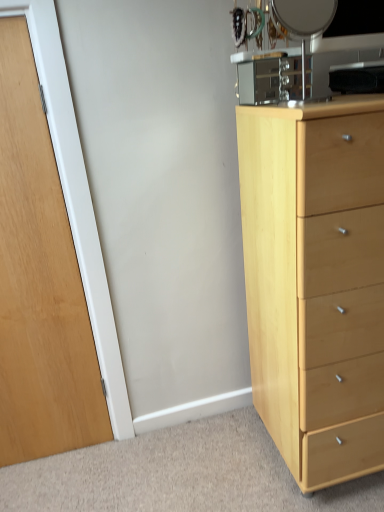
The height and width of the screenshot is (512, 384). What do you see at coordinates (39, 282) in the screenshot? I see `wooden door at left` at bounding box center [39, 282].

You are a GUI agent. You are given a task and a screenshot of the screen. Output one action in this format:
    pyautogui.click(x=<x>, y=<y>)
    Task: Click on the wooden door at left
    The width and height of the screenshot is (384, 512).
    Given the screenshot: What is the action you would take?
    pyautogui.click(x=39, y=282)

The image size is (384, 512). Find the location of `light wood chest of drawers at right`. light wood chest of drawers at right is located at coordinates (316, 280).

Where is `wooden door at left`? wooden door at left is located at coordinates (39, 282).

Considering the relative sizes of light wood chest of drawers at right and wooden door at left in the image provided, is light wood chest of drawers at right taller than wooden door at left?

Incorrect, the height of light wood chest of drawers at right is not larger of that of wooden door at left.

Which object is further away from the camera taking this photo, light wood chest of drawers at right or wooden door at left?

wooden door at left is more distant.

Does light wood chest of drawers at right have a greater width compared to wooden door at left?

Yes, light wood chest of drawers at right is wider than wooden door at left.

What's the angular difference between light wood chest of drawers at right and wooden door at left's facing directions?

There is a 0.741-degree angle between the facing directions of light wood chest of drawers at right and wooden door at left.

Locate an element on the screen. chest of drawers on the right of metallic silver mirror at upper right is located at coordinates (316, 280).

Is light wood chest of drawers at right facing away from metallic silver mirror at upper right?

No, light wood chest of drawers at right is not facing the opposite direction of metallic silver mirror at upper right.

Based on the photo, are light wood chest of drawers at right and metallic silver mirror at upper right beside each other?

No, light wood chest of drawers at right is not with metallic silver mirror at upper right.

Considering the sizes of objects light wood chest of drawers at right and metallic silver mirror at upper right in the image provided, who is thinner, light wood chest of drawers at right or metallic silver mirror at upper right?

With smaller width is metallic silver mirror at upper right.

Looking at this image, which is in front, metallic silver mirror at upper right or light wood chest of drawers at right?

light wood chest of drawers at right is closer to the camera.

Is metallic silver mirror at upper right inside the boundaries of light wood chest of drawers at right, or outside?

metallic silver mirror at upper right is outside light wood chest of drawers at right.

From a real-world perspective, who is located higher, metallic silver mirror at upper right or light wood chest of drawers at right?

metallic silver mirror at upper right is physically above.

Based on the photo, measure the distance from metallic silver mirror at upper right to light wood chest of drawers at right.

metallic silver mirror at upper right is 28.28 inches away from light wood chest of drawers at right.

Which of these two, metallic silver mirror at upper right or wooden door at left, is thinner?

wooden door at left.

From the image's perspective, is metallic silver mirror at upper right located above wooden door at left?

Yes.

Which of these two, metallic silver mirror at upper right or wooden door at left, is bigger?

wooden door at left.

How different are the orientations of wooden door at left and metallic silver mirror at upper right in degrees?

They differ by 0.741 degrees in their facing directions.

Based on the photo, between wooden door at left and metallic silver mirror at upper right, which one appears on the right side from the viewer's perspective?

Positioned to the right is metallic silver mirror at upper right.

Considering the relative sizes of wooden door at left and metallic silver mirror at upper right in the image provided, is wooden door at left wider than metallic silver mirror at upper right?

In fact, wooden door at left might be narrower than metallic silver mirror at upper right.

From the image's perspective, is wooden door at left located above or below metallic silver mirror at upper right?

wooden door at left is below metallic silver mirror at upper right.

Is point (21, 40) positioned after point (311, 334)?

Yes, it is behind point (311, 334).

Based on the photo, is wooden door at left wider or thinner than light wood chest of drawers at right?

Clearly, wooden door at left has less width compared to light wood chest of drawers at right.

Looking at this image, can you confirm if wooden door at left is bigger than light wood chest of drawers at right?

Actually, wooden door at left might be smaller than light wood chest of drawers at right.

From the image's perspective, who appears lower, wooden door at left or light wood chest of drawers at right?

light wood chest of drawers at right.

Where is `door on the left of the light wood chest of drawers at right`? This screenshot has height=512, width=384. door on the left of the light wood chest of drawers at right is located at coordinates (39, 282).

Image resolution: width=384 pixels, height=512 pixels. Identify the location of mirror above the light wood chest of drawers at right (from a real-world perspective). (303, 22).

Consider the image. Looking at the image, which one is located further to metallic silver mirror at upper right, wooden door at left or light wood chest of drawers at right?

wooden door at left lies further to metallic silver mirror at upper right than the other object.

When comparing their distances from light wood chest of drawers at right, does wooden door at left or metallic silver mirror at upper right seem closer?

metallic silver mirror at upper right.

Estimate the real-world distances between objects in this image. Which object is closer to metallic silver mirror at upper right, light wood chest of drawers at right or wooden door at left?

light wood chest of drawers at right lies closer to metallic silver mirror at upper right than the other object.

Looking at the image, which one is located further to wooden door at left, metallic silver mirror at upper right or light wood chest of drawers at right?

Among the two, metallic silver mirror at upper right is located further to wooden door at left.

From the image, which object appears to be farther from wooden door at left, light wood chest of drawers at right or metallic silver mirror at upper right?

metallic silver mirror at upper right lies further to wooden door at left than the other object.

Looking at this image, when comparing their distances from light wood chest of drawers at right, does metallic silver mirror at upper right or wooden door at left seem further?

wooden door at left.

Locate an element on the screen. Image resolution: width=384 pixels, height=512 pixels. mirror located between wooden door at left and light wood chest of drawers at right in the left-right direction is located at coordinates (303, 22).